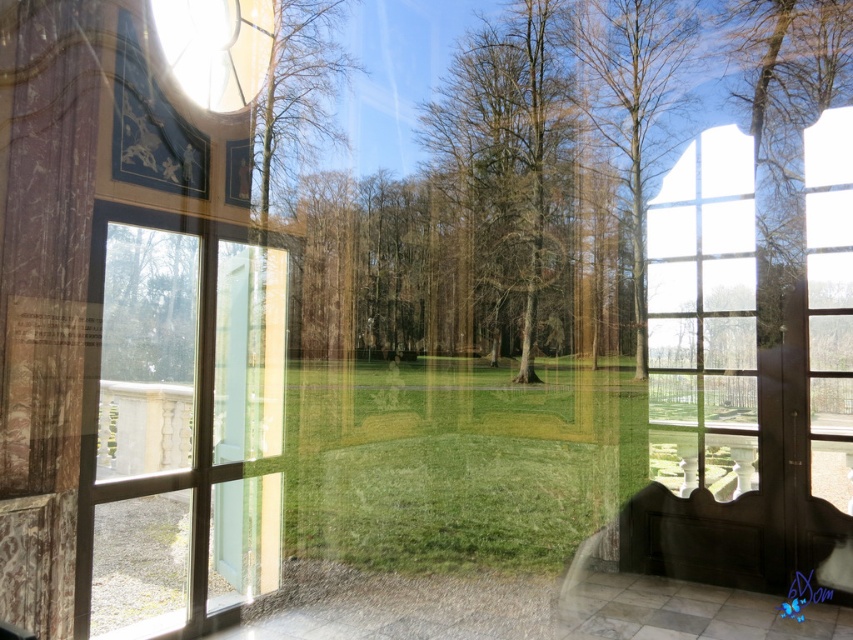
You are standing in the room and want to exit through the clear glass door at left. Which direction should you walk to reach it?

You should walk towards the left side of the room to reach the clear glass door at left.

You are standing in a room with a clear glass window at center. You want to place a large potted plant exactly at the center of the window. According to the image, where should you place the potted plant?

The clear glass window at center is located at point (703, 317) in 2D coordinates, so you should place the potted plant at that exact coordinate to center it.